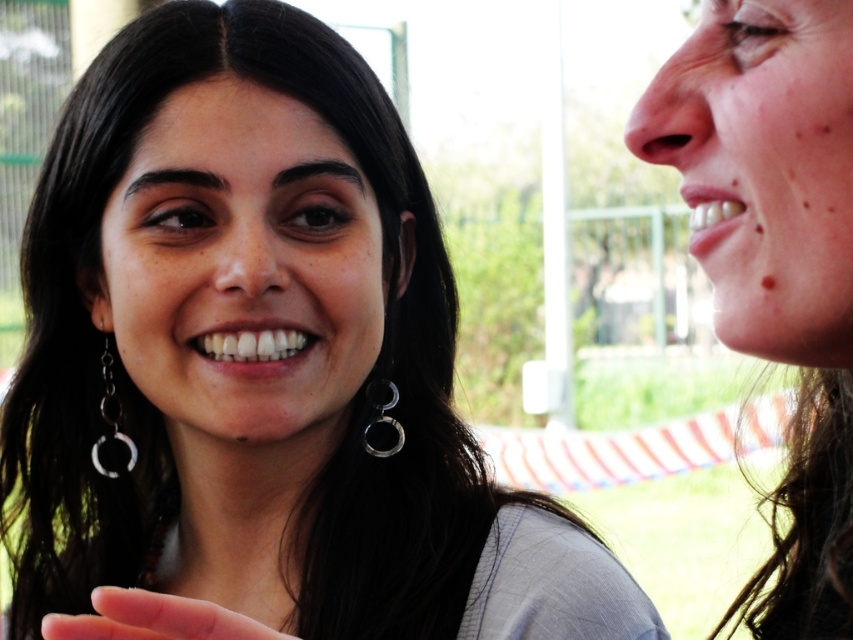
You are standing in a park and see a person with a smooth skin face at right. If you want to take a photo of them from where you are standing, what is the minimum distance you need to maintain to ensure their entire face is in frame?

The minimum distance you need to maintain is 42.00 centimeters because the smooth skin face at right is positioned at that distance from the viewer.

You are a photographer trying to capture a closeup of the smooth skin face at right and the silver metallic earring at left. Since you want to focus on both subjects equally, which one should you adjust your camera focus to prioritize based on their height?

The smooth skin face at right is taller than the silver metallic earring at left, so you should prioritize focusing on the smooth skin face at right first as it is taller and might be more prominent in the frame.

You are a photographer adjusting your camera settings to focus on the smooth skin hand at lower left. What coordinates should you set to ensure the hand is in the center of the frame?

The smooth skin hand at lower left is located at point [154,618], so you should set the coordinates to 0.967 and 0.181 to center the hand in the frame.